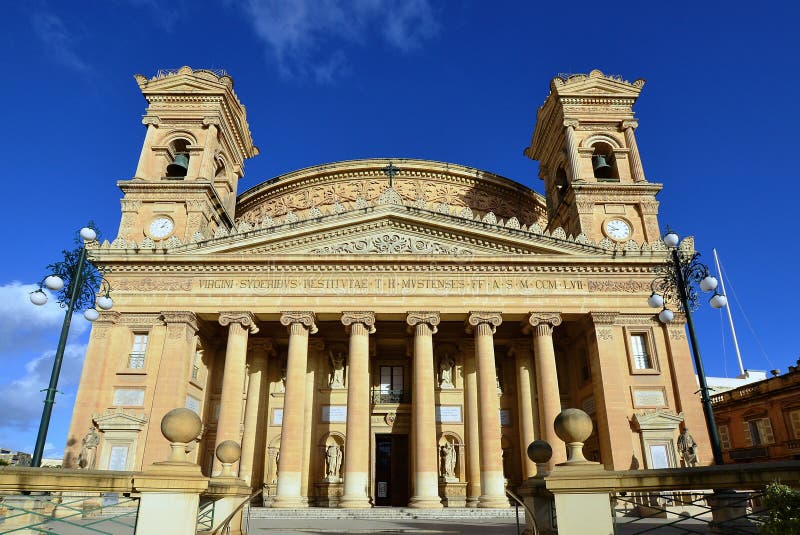
Locate an element on the screen. The image size is (800, 535). stairs is located at coordinates (406, 518), (349, 533).